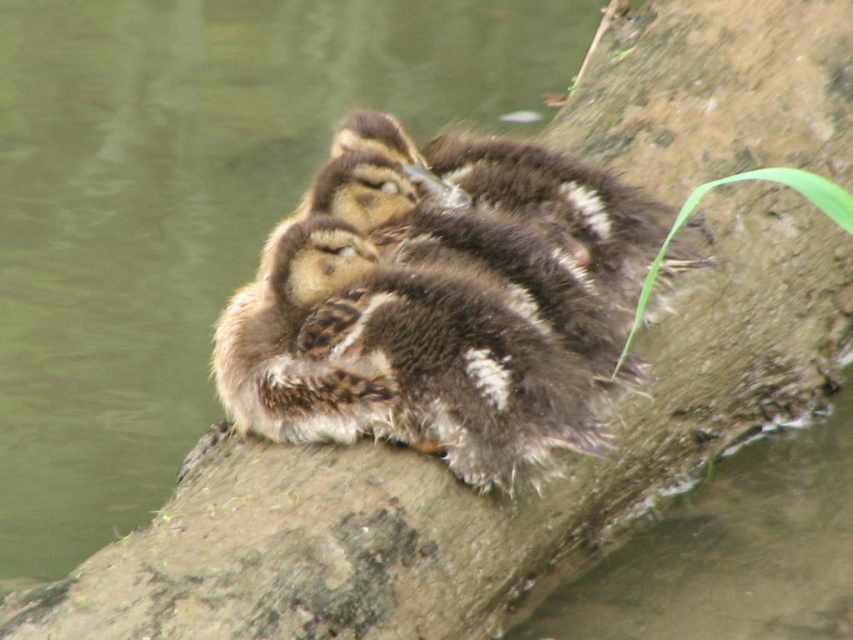
Does brown fuzzy ducklings at center appear on the left side of brown fluffy ducklings at center?

Indeed, brown fuzzy ducklings at center is positioned on the left side of brown fluffy ducklings at center.

Is brown fuzzy ducklings at center wider than brown fluffy ducklings at center?

Yes.

Does point (177, 436) come behind point (525, 256)?

Yes, it is behind point (525, 256).

Image resolution: width=853 pixels, height=640 pixels. What are the coordinates of `brown fuzzy ducklings at center` in the screenshot? It's located at (187, 208).